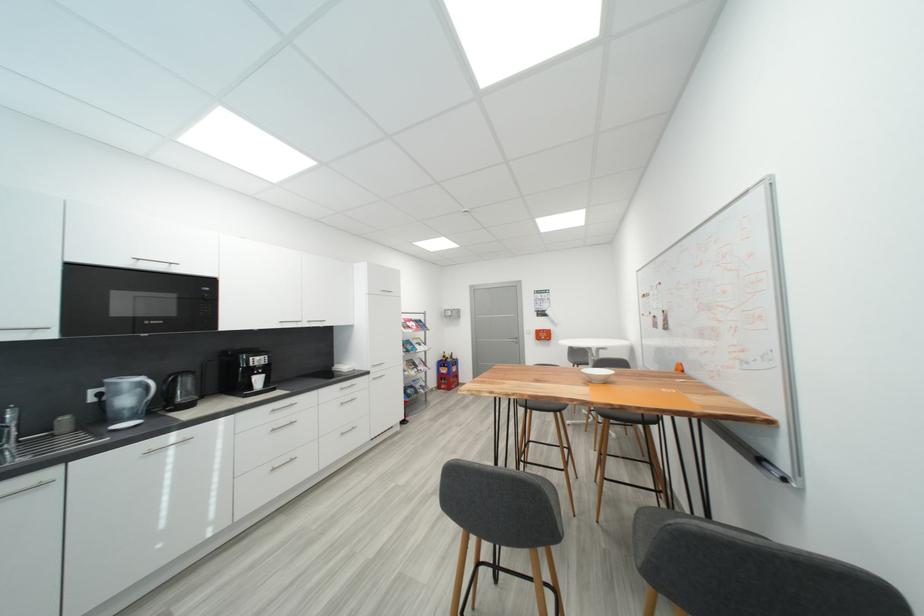
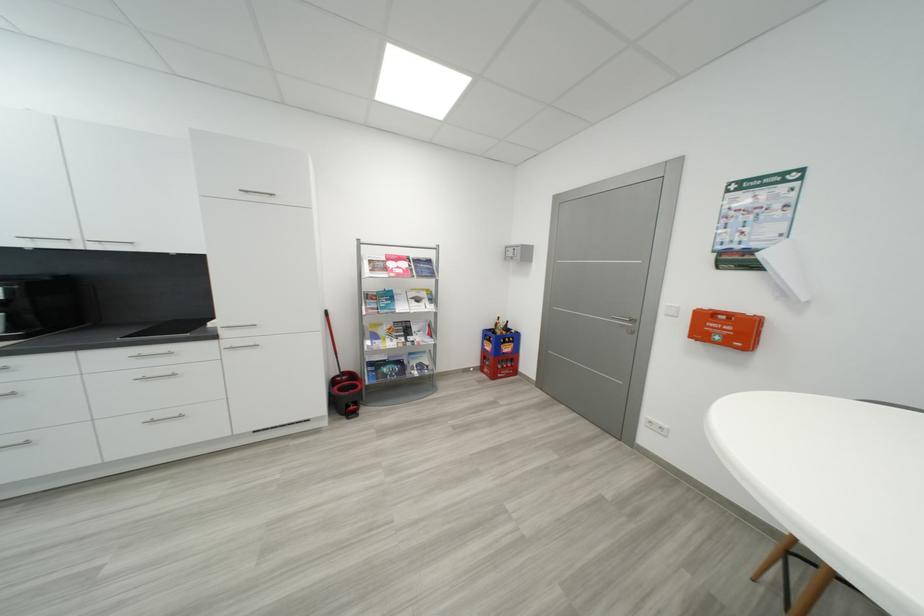
Find the pixel in the second image that matches [424,363] in the first image.

(421, 330)